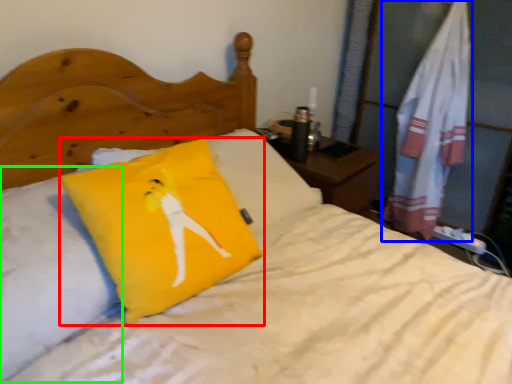
Question: Which object is the farthest from pillow (highlighted by a red box)? Choose among these: material (highlighted by a blue box) or pillow (highlighted by a green box).

Choices:
 (A) material
 (B) pillow

Answer: (A)